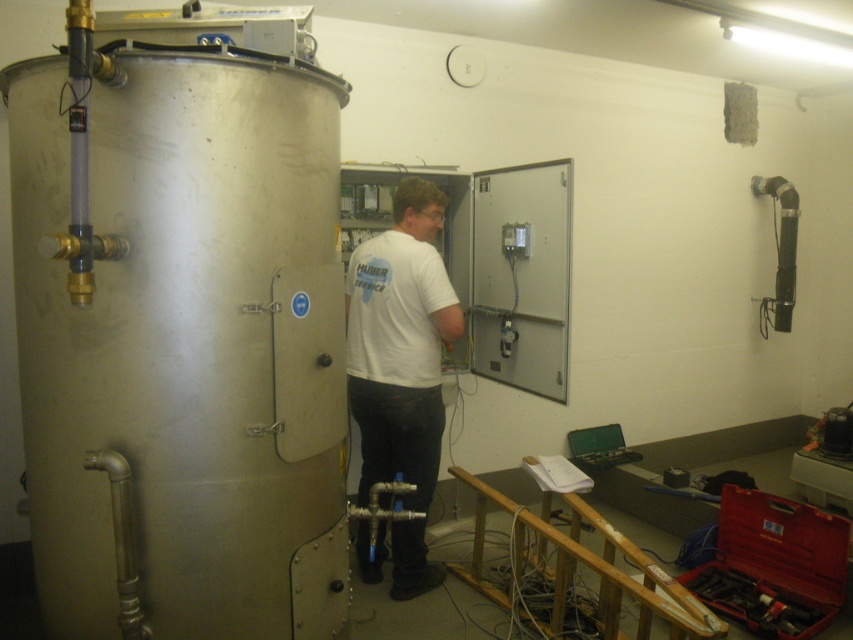
You are an inspector in the utility room and need to access the electrical panel on the right. The white matte shirt at center and the metallic toolbox at lower right are in your way. Which object should you move to clear the path?

The metallic toolbox at lower right should be moved because it is shorter than the white matte shirt at center, making it easier to relocate to access the electrical panel.

You are standing in the industrial utility room and need to reach the electrical panel to the right of the tank. There are two points marked on the floor at coordinates point (192, 321) and point (381, 372). Which point is closer to the electrical panel?

Point (381, 372) is closer to the electrical panel because it is located to the right of the tank, and the description states that point (192, 321) is in front of point (381, 372). Since being in front implies a forward position relative to the electrical panel, the point behind it would be closer to the panel.

From the picture: You are a technician in the utility room and need to access the metallic toolbox at lower right. However, the polished metallic water heater at left is blocking your path. Can you move the toolbox to the right side of the water heater?

The polished metallic water heater at left is above the metallic toolbox at lower right, so the toolbox is already positioned below the water heater. Since the water heater is above, you can move the toolbox to the right side of it without obstruction.